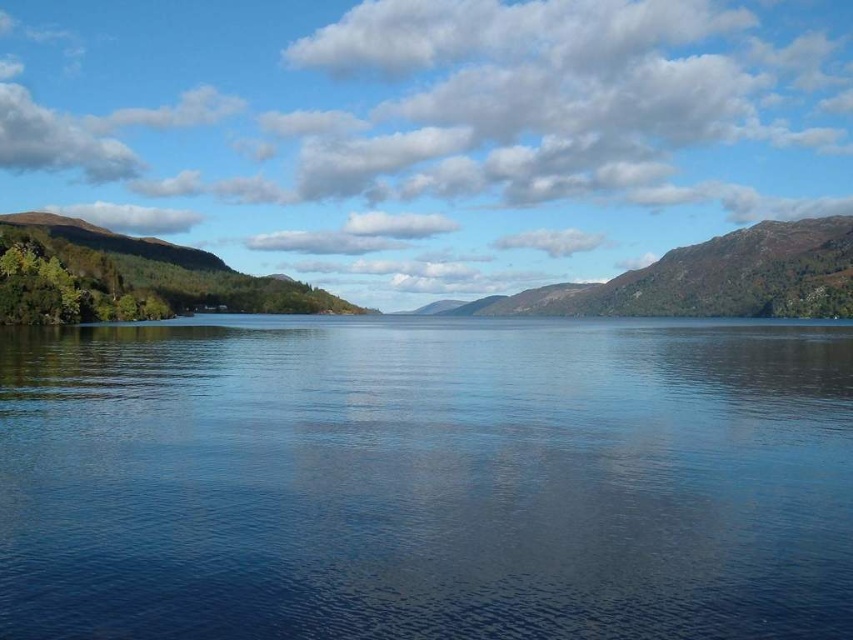
Question: Which point is farther to the camera?

Choices:
 (A) green textured hillside at left
 (B) green mossy rock at center

Answer: (B)

Question: Estimate the real-world distances between objects in this image. Which object is closer to the green mossy rock at center?

Choices:
 (A) transparent water at center
 (B) green textured hillside at left

Answer: (B)

Question: Which point is closer to the camera taking this photo?

Choices:
 (A) click(129, 285)
 (B) click(650, 456)
 (C) click(737, 296)

Answer: (B)

Question: Is transparent water at center smaller than green mossy rock at center?

Choices:
 (A) yes
 (B) no

Answer: (A)

Question: Can you confirm if transparent water at center is positioned to the right of green mossy rock at center?

Choices:
 (A) yes
 (B) no

Answer: (B)

Question: Is green textured hillside at left positioned in front of green mossy rock at center?

Choices:
 (A) no
 (B) yes

Answer: (B)